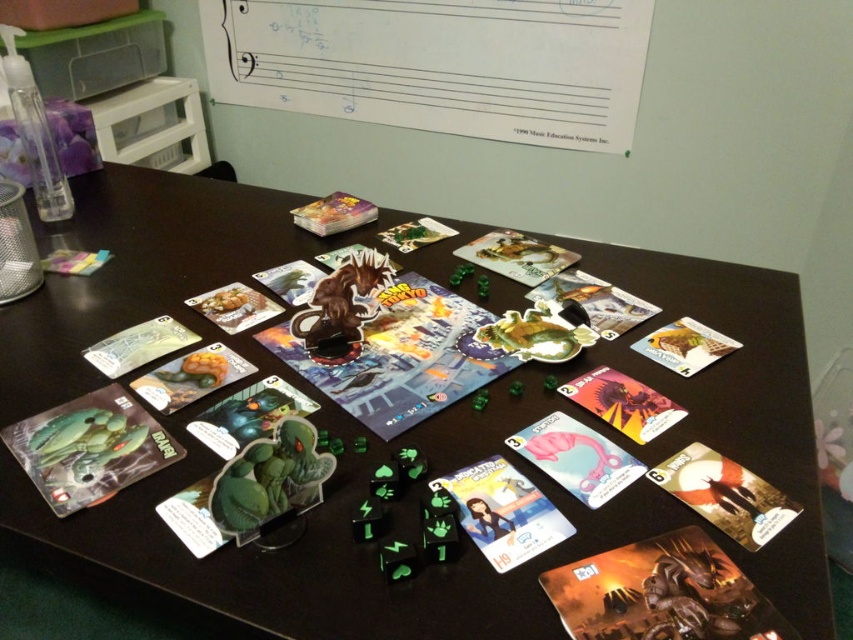
You are a player sitting at the edge of the table and want to pick up the matte plastic postcard at center. Can you reach it without moving the black plastic table at center?

The black plastic table at center is closer to the viewer than the matte plastic postcard at center, so you cannot reach the matte plastic postcard at center without moving the black plastic table at center first.

You are a player trying to reach the black plastic table at center from your current position. The camera is positioned where you are standing. Can you comfortably reach the table without moving your chair?

The black plastic table at center and camera are 21.50 inches apart, so yes, you can comfortably reach the table without moving your chair since the distance is within a typical arm reach.